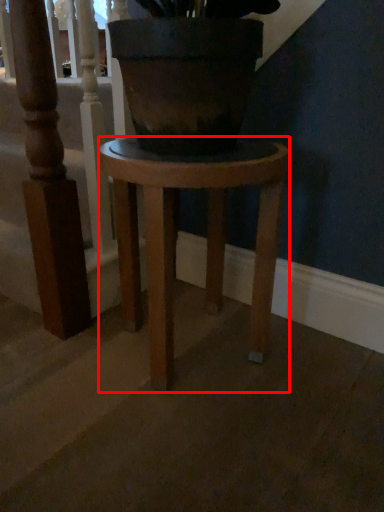
Question: In this image, where is stool (annotated by the red box) located relative to rail?

Choices:
 (A) right
 (B) left

Answer: (A)